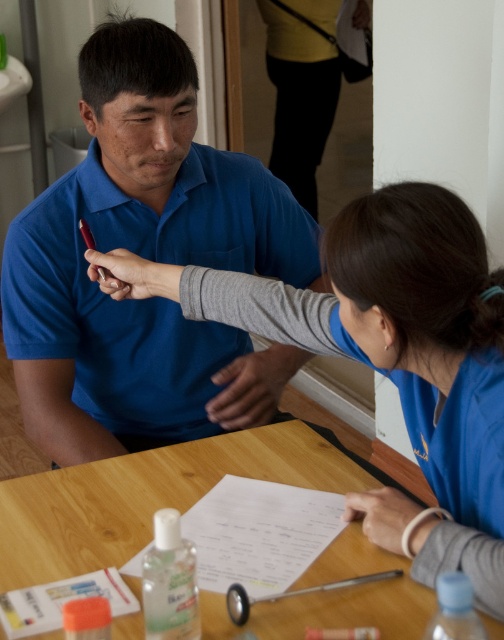
Between blue fabric shirt at upper center and wooden table at center, which one has more height?

With more height is blue fabric shirt at upper center.

Does blue fabric shirt at upper center appear over wooden table at center?

Yes, blue fabric shirt at upper center is above wooden table at center.

Does point (442, 451) come farther from viewer compared to point (28, 499)?

That is False.

Locate an element on the screen. Image resolution: width=504 pixels, height=640 pixels. blue fabric shirt at upper center is located at coordinates (392, 356).

Does matte blue shirt at center come behind blue fabric shirt at upper center?

Yes, it is.

Is matte blue shirt at center to the right of blue fabric shirt at upper center from the viewer's perspective?

Incorrect, matte blue shirt at center is not on the right side of blue fabric shirt at upper center.

Where is `matte blue shirt at center`? The height and width of the screenshot is (640, 504). matte blue shirt at center is located at coordinates (148, 259).

Does matte blue shirt at center have a smaller size compared to wooden table at center?

No, matte blue shirt at center is not smaller than wooden table at center.

The width and height of the screenshot is (504, 640). Identify the location of matte blue shirt at center. click(148, 259).